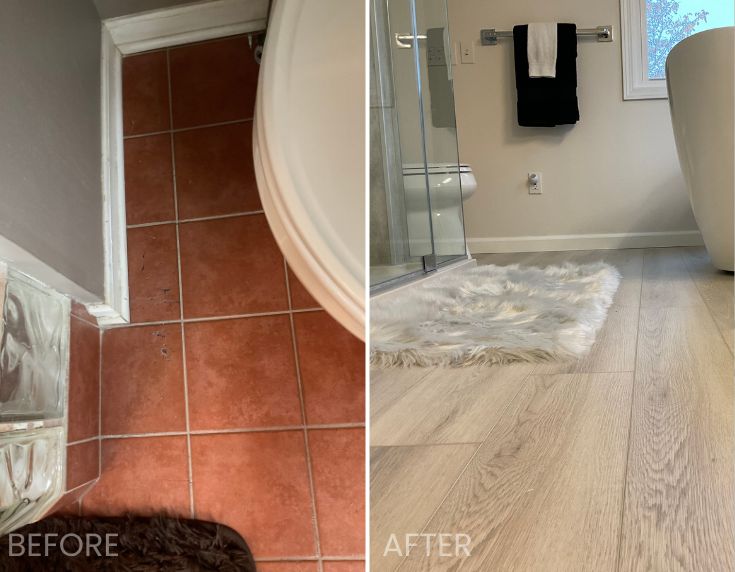
Locate an element on the screen. The width and height of the screenshot is (735, 572). trash can is located at coordinates (711, 145).